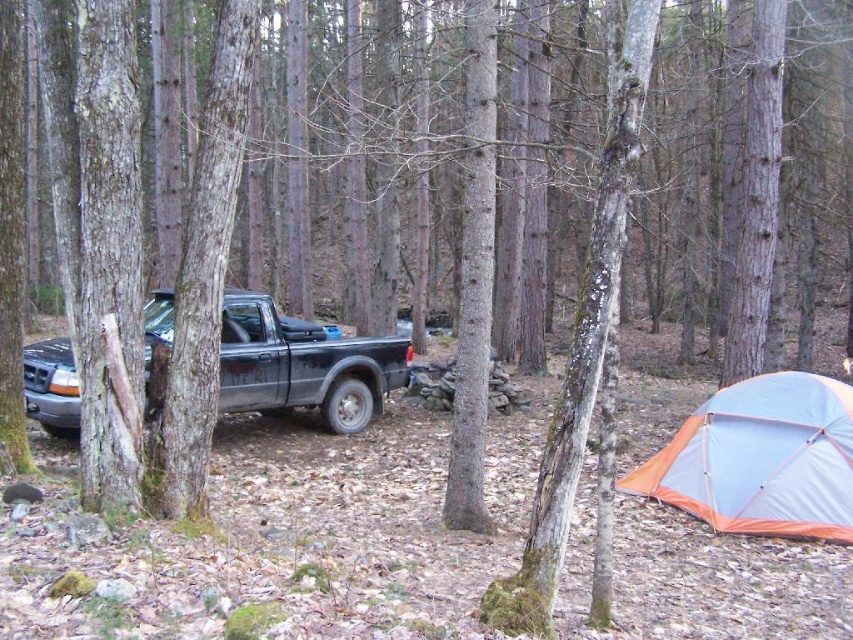
Question: Can you confirm if orange fabric tent at lower right is thinner than matte black truck at left?

Choices:
 (A) yes
 (B) no

Answer: (B)

Question: Which point is closer to the camera?

Choices:
 (A) (254, 330)
 (B) (734, 451)

Answer: (B)

Question: Can you confirm if orange fabric tent at lower right is positioned to the left of matte black truck at left?

Choices:
 (A) no
 (B) yes

Answer: (A)

Question: Which of the following is the farthest from the observer?

Choices:
 (A) orange fabric tent at lower right
 (B) matte black truck at left

Answer: (B)

Question: Is orange fabric tent at lower right behind matte black truck at left?

Choices:
 (A) no
 (B) yes

Answer: (A)